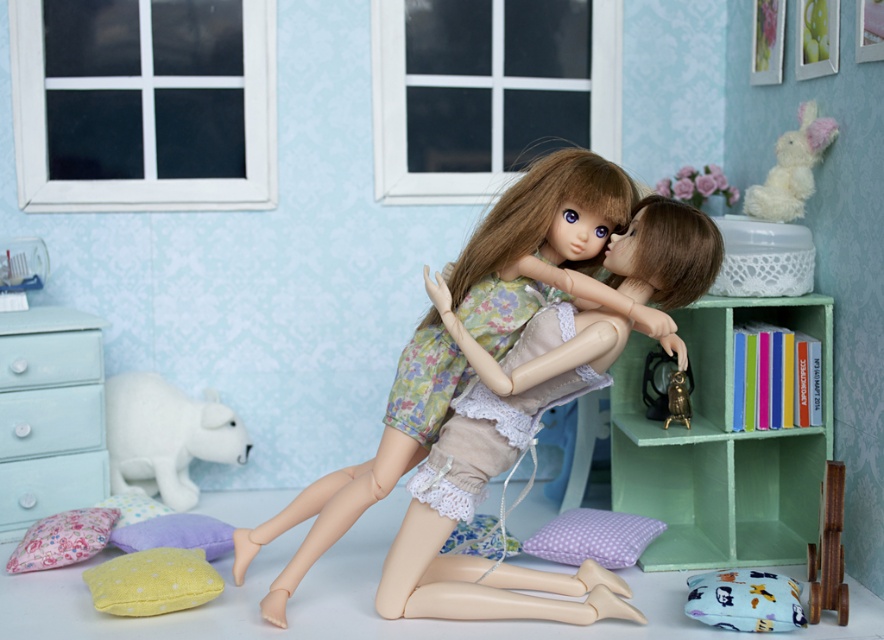
Is lavender dotted fabric pillow at lower center to the right of lavender fabric pillow at lower left from the viewer's perspective?

Correct, you'll find lavender dotted fabric pillow at lower center to the right of lavender fabric pillow at lower left.

Does lavender dotted fabric pillow at lower center have a greater height compared to lavender fabric pillow at lower left?

Correct, lavender dotted fabric pillow at lower center is much taller as lavender fabric pillow at lower left.

Is point (638, 532) closer to viewer compared to point (150, 502)?

Yes, point (638, 532) is closer to viewer.

The height and width of the screenshot is (640, 884). What are the coordinates of `lavender dotted fabric pillow at lower center` in the screenshot? It's located at (593, 538).

Is the position of blue fabric pillow at lower right more distant than that of matte light blue drawer at left?

No.

The height and width of the screenshot is (640, 884). I want to click on blue fabric pillow at lower right, so click(745, 600).

The image size is (884, 640). What are the coordinates of `blue fabric pillow at lower right` in the screenshot? It's located at (745, 600).

Locate an element on the screen. blue fabric pillow at lower right is located at coordinates (745, 600).

Which is more to the right, matte light blue drawer at lower left or floral fabric pillow at lower left?

Positioned to the right is floral fabric pillow at lower left.

Who is positioned more to the left, matte light blue drawer at lower left or floral fabric pillow at lower left?

Positioned to the left is matte light blue drawer at lower left.

At what (x,y) coordinates should I click in order to perform the action: click on matte light blue drawer at lower left. Please return your answer as a coordinate pair (x, y). The image size is (884, 640). Looking at the image, I should click on (51, 420).